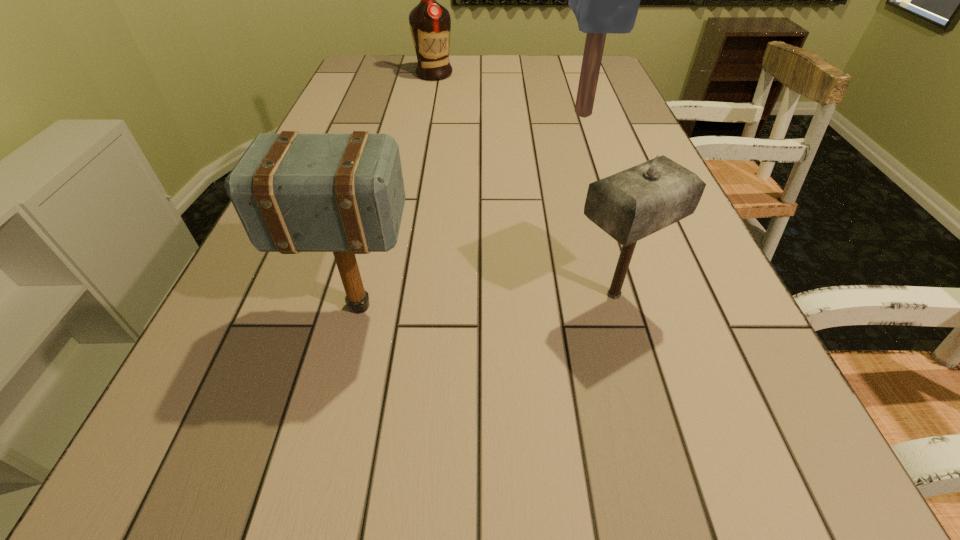
This screenshot has width=960, height=540. I want to click on the farthest mallet, so click(604, 0).

Where is `the second farthest object`? the second farthest object is located at coordinates (604, 0).

The width and height of the screenshot is (960, 540). What are the coordinates of `the farthest object` in the screenshot? It's located at (430, 23).

Where is `the leftmost mallet`? This screenshot has width=960, height=540. the leftmost mallet is located at coordinates (343, 193).

In order to click on vacant space situated 0.320m on the left of the third nearest object in this screenshot , I will do `click(451, 113)`.

The height and width of the screenshot is (540, 960). What are the coordinates of `free space located 0.210m on the front and back of the farthest object` in the screenshot? It's located at (427, 111).

This screenshot has width=960, height=540. What are the coordinates of `blank space located 0.380m on the striking surface of the leftmost mallet` in the screenshot? It's located at (630, 306).

The width and height of the screenshot is (960, 540). Identify the location of object that is at the far edge. (430, 23).

I want to click on object at the left edge, so click(343, 193).

Locate an element on the screen. The image size is (960, 540). free spot at the far edge of the desktop is located at coordinates (397, 79).